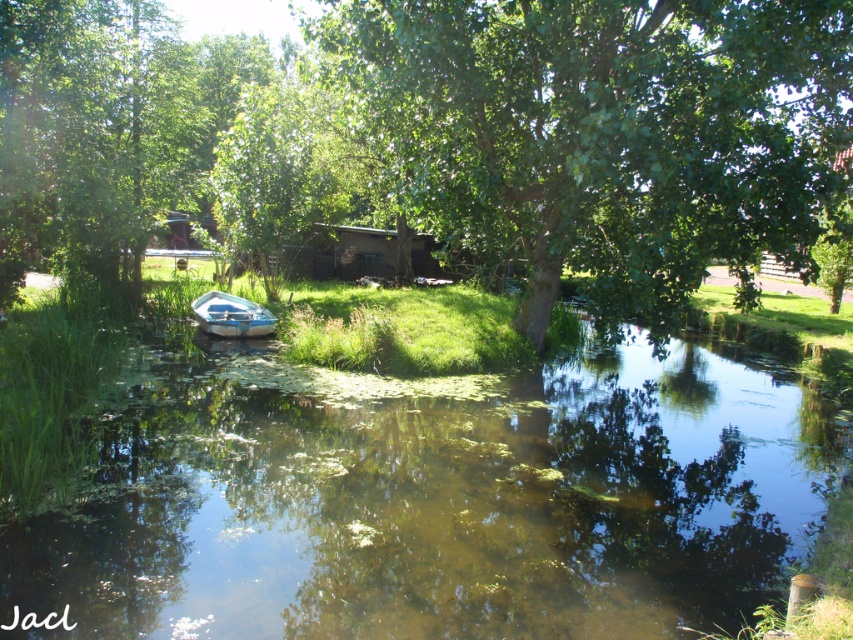
The height and width of the screenshot is (640, 853). Describe the element at coordinates (433, 499) in the screenshot. I see `green algae-covered water at center` at that location.

Which is above, green algae-covered water at center or green leafy tree at center?

green leafy tree at center is higher up.

Find the location of `green algae-covered water at center`. green algae-covered water at center is located at coordinates (433, 499).

Locate an element on the screen. The image size is (853, 640). green algae-covered water at center is located at coordinates (433, 499).

Is green algae-covered water at center below white plastic boat at center?

Correct, green algae-covered water at center is located below white plastic boat at center.

The image size is (853, 640). What do you see at coordinates (433, 499) in the screenshot?
I see `green algae-covered water at center` at bounding box center [433, 499].

At what (x,y) coordinates should I click in order to perform the action: click on green algae-covered water at center. Please return your answer as a coordinate pair (x, y). The height and width of the screenshot is (640, 853). Looking at the image, I should click on pos(433,499).

Is point (540, 49) more distant than point (215, 296)?

No.

Between point (379, 19) and point (225, 305), which one is positioned in front?

Point (379, 19) is more forward.

Where is `green leafy tree at center`? The image size is (853, 640). green leafy tree at center is located at coordinates (602, 131).